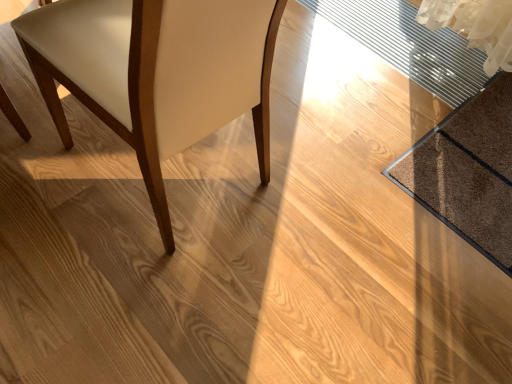
This screenshot has width=512, height=384. Find the location of `free area below matte white chair at center (from a real-world perspective)`. free area below matte white chair at center (from a real-world perspective) is located at coordinates (166, 168).